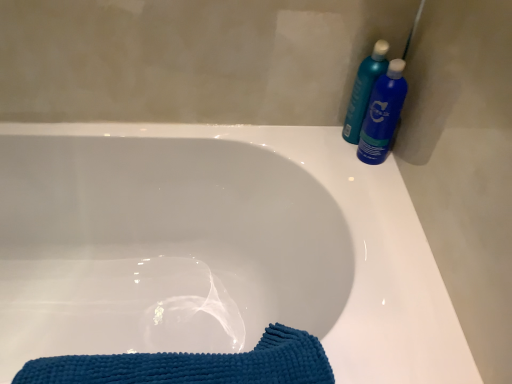
Where is `vacant space to the left of teal plastic bottles at upper right, which is the first cleaning product in left-to-right order`? Image resolution: width=512 pixels, height=384 pixels. vacant space to the left of teal plastic bottles at upper right, which is the first cleaning product in left-to-right order is located at coordinates (304, 134).